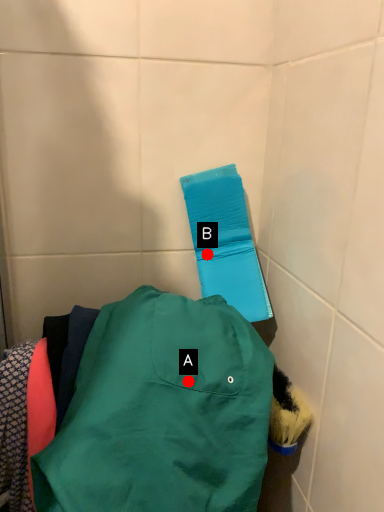
Question: Two points are circled on the image, labeled by A and B beside each circle. Which of the following is the closest to the observer?

Choices:
 (A) A is closer
 (B) B is closer

Answer: (A)